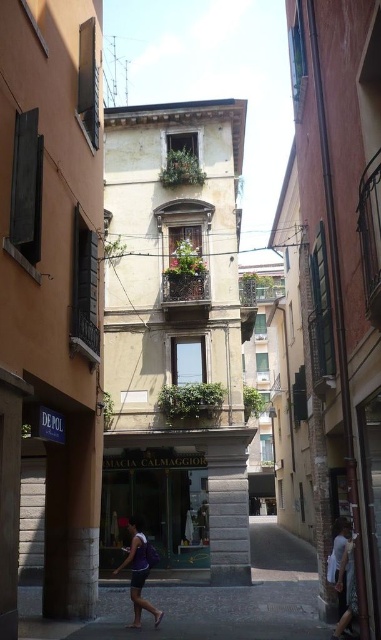
Does white cotton shirt at lower right have a lesser height compared to purple fabric at center?

In fact, white cotton shirt at lower right may be taller than purple fabric at center.

Can you confirm if white cotton shirt at lower right is thinner than purple fabric at center?

No.

Is point (347, 605) closer to camera compared to point (137, 536)?

That is True.

Identify the location of white cotton shirt at lower right. (345, 577).